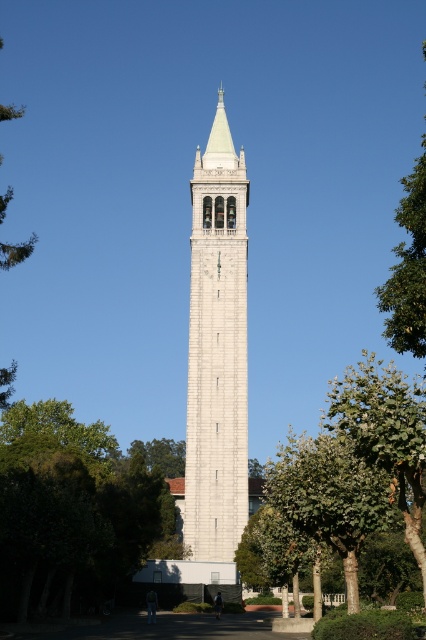
You are standing in a park and see the green leafy tree at lower left and the white stone bell tower at center. Which object is closer to you?

The green leafy tree at lower left is closer to you because it is in front of the white stone bell tower at center.

You are standing in front of the white stone bell tower at center and want to take a photo of it with the green leafy tree at lower left in the background. Which side should you stand on to ensure the tree is fully visible behind the tower?

You should stand on the right side of the white stone bell tower at center because the green leafy tree at lower left is positioned to the left of the tower. By standing to the right of the tower, the tree will be visible behind it when taking the photo.

Looking at this image, you are standing in front of the bell tower and want to take a photo that includes both the white stone bell tower at center and the green leafy tree at center. Which object should you focus on first to ensure both are in frame?

The white stone bell tower at center is above the green leafy tree at center, so you should focus on the green leafy tree at center first to ensure both are in frame.